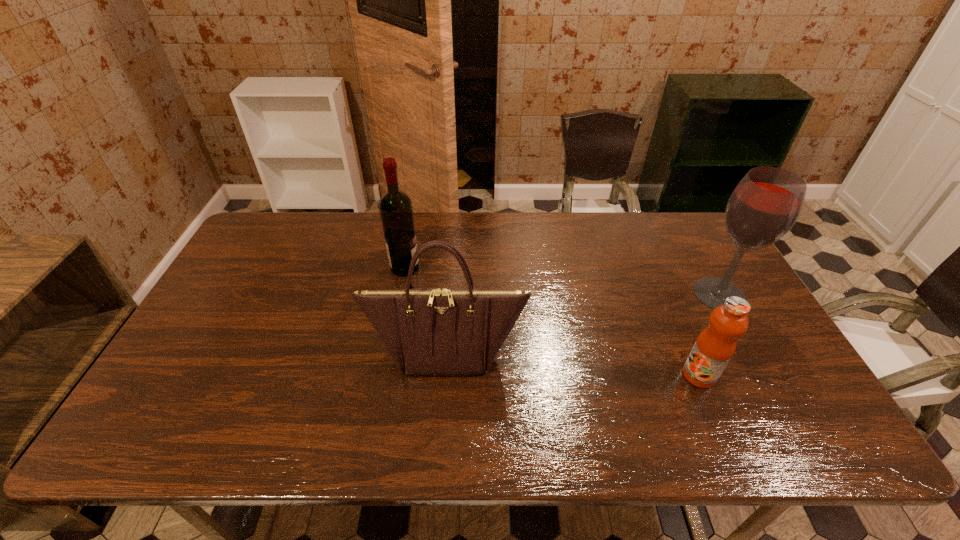
Locate an element on the screen. This screenshot has width=960, height=540. the rightmost object is located at coordinates [x=766, y=203].

Locate an element on the screen. the left alcohol is located at coordinates (396, 211).

Locate an element on the screen. Image resolution: width=960 pixels, height=540 pixels. handbag is located at coordinates (428, 331).

At what (x,y) coordinates should I click in order to perform the action: click on the shortest object. Please return your answer as a coordinate pair (x, y). The width and height of the screenshot is (960, 540). Looking at the image, I should click on (716, 344).

Where is `fruit juice`? Image resolution: width=960 pixels, height=540 pixels. fruit juice is located at coordinates (716, 344).

Identify the location of vacant area located 0.310m on the left of the right alcohol. This screenshot has width=960, height=540. (588, 294).

The height and width of the screenshot is (540, 960). I want to click on blank space located on the front and back of the left alcohol, so click(533, 268).

Locate an element on the screen. This screenshot has height=540, width=960. free region located 0.180m on the front-facing side of the handbag is located at coordinates (440, 448).

You are a GUI agent. You are given a task and a screenshot of the screen. Output one action in this format:
    pyautogui.click(x=<x>, y=<y>)
    Task: Click on the free space located on the front label of the fruit juice
    This screenshot has height=540, width=960.
    Given the screenshot: What is the action you would take?
    pyautogui.click(x=603, y=375)

You are a GUI agent. You are given a task and a screenshot of the screen. Output one action in this format:
    pyautogui.click(x=<x>, y=<y>)
    Task: Click on the vacant space located 0.250m on the front label of the fruit juice
    
    Given the screenshot: What is the action you would take?
    pyautogui.click(x=584, y=375)